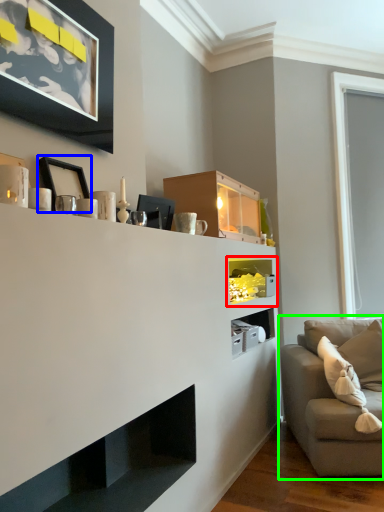
Question: Which object is the farthest from shelf (highlighted by a red box)? Choose among these: picture frame (highlighted by a blue box) or studio couch (highlighted by a green box).

Choices:
 (A) picture frame
 (B) studio couch

Answer: (A)